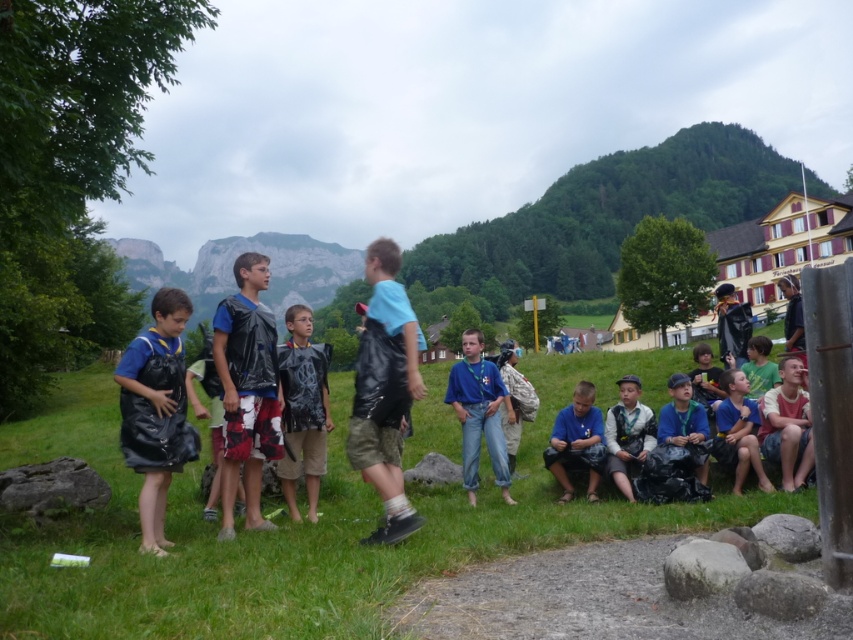
Is green forested mountain at upper center smaller than matte black raincoat at left?

Incorrect, green forested mountain at upper center is not smaller in size than matte black raincoat at left.

Does point (582, 262) come closer to viewer compared to point (167, 324)?

No, it is behind (167, 324).

Locate an element on the screen. Image resolution: width=853 pixels, height=640 pixels. green forested mountain at upper center is located at coordinates (601, 220).

At what (x,y) coordinates should I click in order to perform the action: click on blue denim jeans at center. Please return your answer as a coordinate pair (x, y). The height and width of the screenshot is (640, 853). Looking at the image, I should click on (479, 413).

Which is above, blue denim jeans at center or white cotton shirt at center?

blue denim jeans at center

I want to click on blue denim jeans at center, so click(479, 413).

Between point (390, 426) and point (212, 356), which one is positioned in front?

Positioned in front is point (390, 426).

Image resolution: width=853 pixels, height=640 pixels. What are the coordinates of `matte black backpack at center` in the screenshot? It's located at (386, 390).

Locate an element on the screen. The width and height of the screenshot is (853, 640). matte black backpack at center is located at coordinates (386, 390).